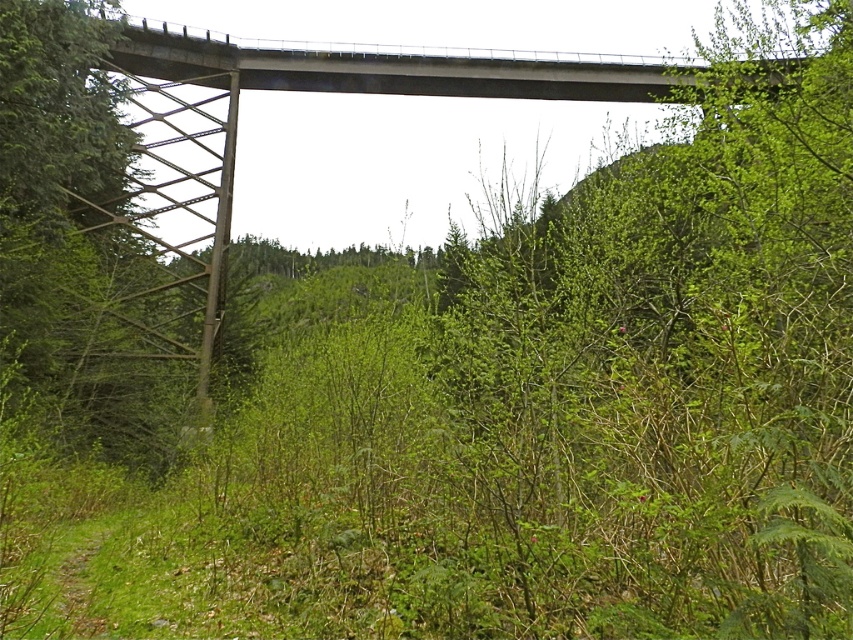
Question: Does metallic bridge at center have a lesser width compared to concrete bridge at upper center?

Choices:
 (A) no
 (B) yes

Answer: (A)

Question: Is metallic bridge at center thinner than concrete bridge at upper center?

Choices:
 (A) no
 (B) yes

Answer: (A)

Question: Which of the following is the closest to the observer?

Choices:
 (A) (102, 12)
 (B) (177, 84)

Answer: (A)

Question: Which of the following is the farthest from the observer?

Choices:
 (A) (152, 28)
 (B) (495, 84)

Answer: (B)

Question: Can you confirm if metallic bridge at center is wider than concrete bridge at upper center?

Choices:
 (A) no
 (B) yes

Answer: (B)